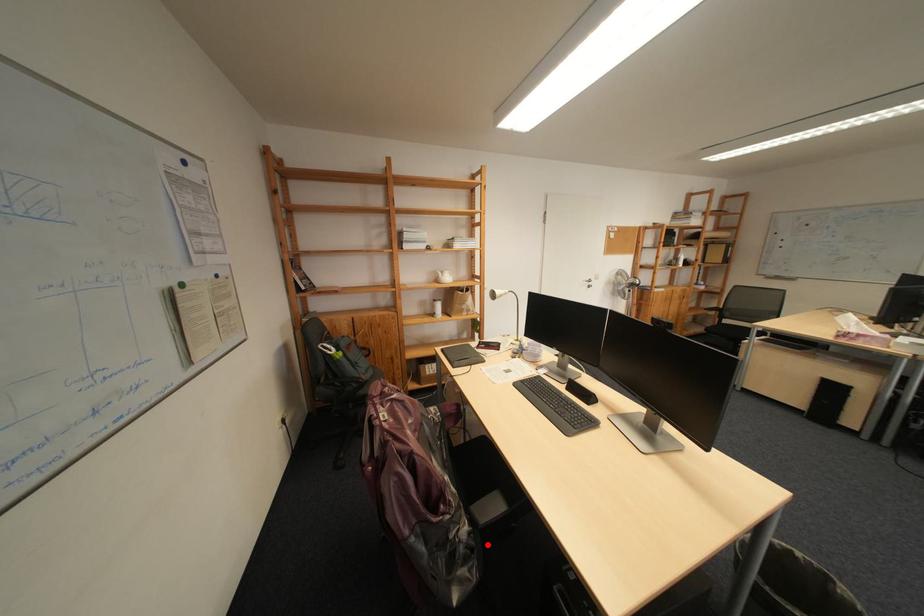
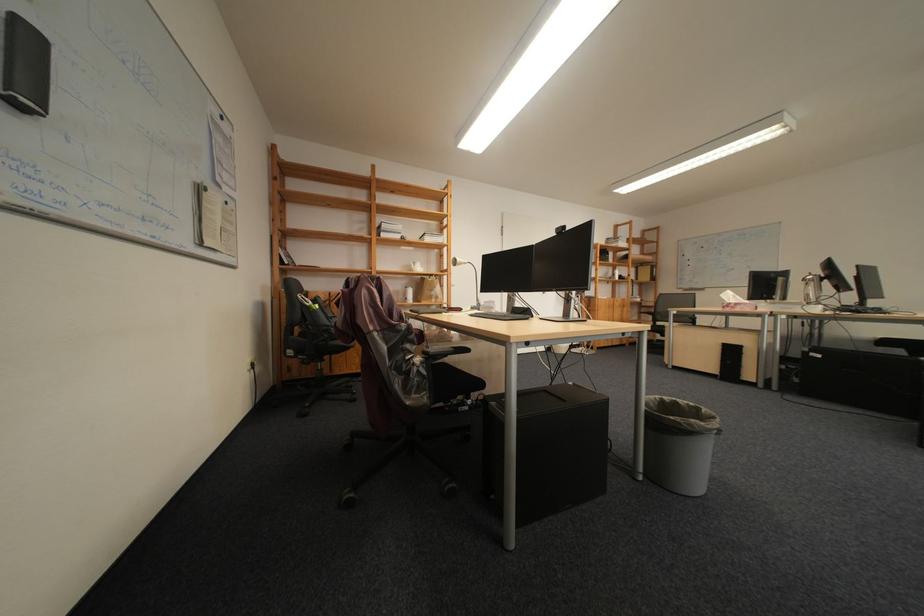
Locate, in the second image, the point that corresponds to the highlighted location in the first image.

(440, 375)